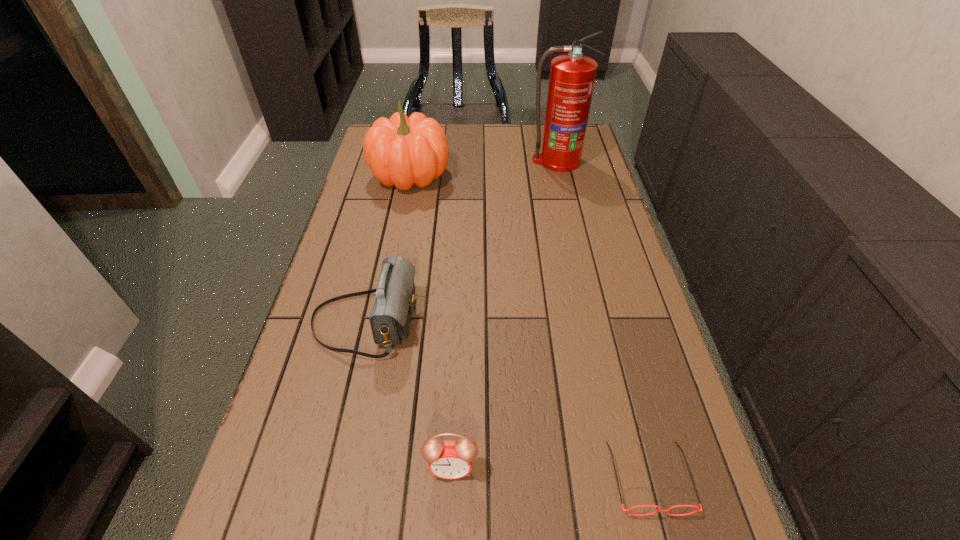
You are a GUI agent. You are given a task and a screenshot of the screen. Output one action in this format:
    pyautogui.click(x=<x>, y=<y>)
    Task: Click on the tallest object
    
    Given the screenshot: What is the action you would take?
    point(572,76)

The width and height of the screenshot is (960, 540). Find the location of `pumpkin`. pumpkin is located at coordinates (401, 151).

Find the location of a particular element. shoulder bag is located at coordinates (390, 318).

The height and width of the screenshot is (540, 960). What are the coordinates of `the third farthest object` in the screenshot? It's located at (390, 318).

Locate an element on the screen. This screenshot has width=960, height=540. alarm clock is located at coordinates (450, 460).

Identify the location of spectacles. (657, 510).

Locate an element on the screen. The image size is (960, 540). vacant space located 0.220m on the instruction side of the fire extinguisher is located at coordinates (568, 213).

Image resolution: width=960 pixels, height=540 pixels. Identify the location of free spot located 0.150m on the back of the second tallest object. (419, 133).

Where is `free region located on the back of the third tallest object`? This screenshot has width=960, height=540. free region located on the back of the third tallest object is located at coordinates (389, 215).

Find the location of a particular element. vacant space situated on the clock face of the alarm clock is located at coordinates (448, 538).